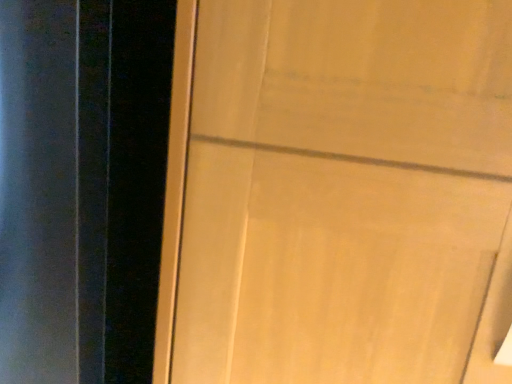
At what (x,y) coordinates should I click in order to perform the action: click on matte black screen door at left. Please return your answer as a coordinate pair (x, y). This screenshot has height=384, width=512. Looking at the image, I should click on (82, 186).

Describe the element at coordinates (82, 186) in the screenshot. Image resolution: width=512 pixels, height=384 pixels. I see `matte black screen door at left` at that location.

At what (x,y) coordinates should I click in order to perform the action: click on matte black screen door at left. Please return your answer as a coordinate pair (x, y). Looking at the image, I should click on (82, 186).